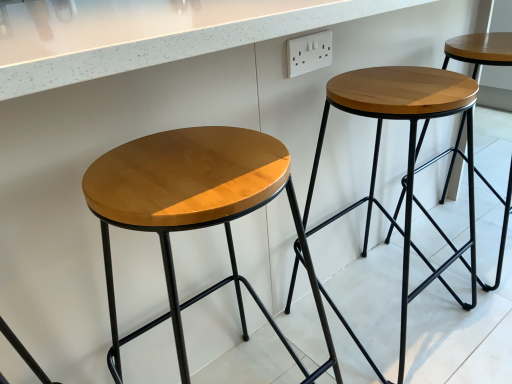
Measure the distance between wooden stool at center, placed as the first stool when sorted from right to left, and camera.

The distance of wooden stool at center, placed as the first stool when sorted from right to left, from camera is 31.53 inches.

The width and height of the screenshot is (512, 384). I want to click on white plastic outlet at upper center, so click(309, 53).

Find the location of a particular element. wooden stool at center, placed as the first stool when sorted from right to left is located at coordinates click(x=411, y=158).

Which of these two, white plastic outlet at upper center or matte wood stool at center, which is counted as the first stool, starting from the left, is bigger?

With larger size is matte wood stool at center, which is counted as the first stool, starting from the left.

Is white plastic outlet at upper center in front of or behind matte wood stool at center, which is the second stool in right-to-left order, in the image?

In the image, white plastic outlet at upper center appears behind matte wood stool at center, which is the second stool in right-to-left order.

Does white plastic outlet at upper center have a lesser width compared to matte wood stool at center, which is counted as the first stool, starting from the left?

Correct, the width of white plastic outlet at upper center is less than that of matte wood stool at center, which is counted as the first stool, starting from the left.

Between matte wood stool at center, which is the second stool in right-to-left order, and white plastic outlet at upper center, which one has smaller width?

Thinner between the two is white plastic outlet at upper center.

Considering the sizes of matte wood stool at center, which is the second stool in right-to-left order, and white plastic outlet at upper center in the image, is matte wood stool at center, which is the second stool in right-to-left order, bigger or smaller than white plastic outlet at upper center?

Clearly, matte wood stool at center, which is the second stool in right-to-left order, is larger in size than white plastic outlet at upper center.

Is matte wood stool at center, which is the second stool in right-to-left order, aimed at white plastic outlet at upper center?

No, matte wood stool at center, which is the second stool in right-to-left order, is not aimed at white plastic outlet at upper center.

Considering the relative sizes of white plastic outlet at upper center and wooden stool at center, the second stool when ordered from left to right, in the image provided, is white plastic outlet at upper center smaller than wooden stool at center, the second stool when ordered from left to right,?

Correct, white plastic outlet at upper center occupies less space than wooden stool at center, the second stool when ordered from left to right.

Which of these two, white plastic outlet at upper center or wooden stool at center, placed as the first stool when sorted from right to left, stands shorter?

Standing shorter between the two is white plastic outlet at upper center.

Does white plastic outlet at upper center turn towards wooden stool at center, the second stool when ordered from left to right?

No, white plastic outlet at upper center is not facing towards wooden stool at center, the second stool when ordered from left to right.

Is white plastic outlet at upper center directly adjacent to wooden stool at center, the second stool when ordered from left to right?

There is a gap between white plastic outlet at upper center and wooden stool at center, the second stool when ordered from left to right.

From the image's perspective, is matte wood stool at center, which is the second stool in right-to-left order, beneath wooden stool at center, placed as the first stool when sorted from right to left?

Indeed, from the image's perspective, matte wood stool at center, which is the second stool in right-to-left order, is shown beneath wooden stool at center, placed as the first stool when sorted from right to left.

Considering their positions, is matte wood stool at center, which is the second stool in right-to-left order, located in front of or behind wooden stool at center, placed as the first stool when sorted from right to left?

Visually, matte wood stool at center, which is the second stool in right-to-left order, is located in front of wooden stool at center, placed as the first stool when sorted from right to left.

Between matte wood stool at center, which is the second stool in right-to-left order, and wooden stool at center, the second stool when ordered from left to right, which one has larger width?

With larger width is wooden stool at center, the second stool when ordered from left to right.

Who is taller, matte wood stool at center, which is the second stool in right-to-left order, or wooden stool at center, placed as the first stool when sorted from right to left?

With more height is matte wood stool at center, which is the second stool in right-to-left order.

Could matte wood stool at center, which is the second stool in right-to-left order, be considered to be inside wooden stool at center, placed as the first stool when sorted from right to left?

Actually, matte wood stool at center, which is the second stool in right-to-left order, is outside wooden stool at center, placed as the first stool when sorted from right to left.

Considering the sizes of wooden stool at center, placed as the first stool when sorted from right to left, and matte wood stool at center, which is counted as the first stool, starting from the left, in the image, is wooden stool at center, placed as the first stool when sorted from right to left, wider or thinner than matte wood stool at center, which is counted as the first stool, starting from the left,?

In the image, wooden stool at center, placed as the first stool when sorted from right to left, appears to be wider than matte wood stool at center, which is counted as the first stool, starting from the left.

Consider the image. Is wooden stool at center, the second stool when ordered from left to right, taller than matte wood stool at center, which is the second stool in right-to-left order?

Incorrect, the height of wooden stool at center, the second stool when ordered from left to right, is not larger of that of matte wood stool at center, which is the second stool in right-to-left order.

Which of these two, wooden stool at center, the second stool when ordered from left to right, or white plastic outlet at upper center, is thinner?

Thinner between the two is white plastic outlet at upper center.

Is wooden stool at center, the second stool when ordered from left to right, positioned with its back to white plastic outlet at upper center?

No, wooden stool at center, the second stool when ordered from left to right, is not facing away from white plastic outlet at upper center.

Does point (439, 114) lie behind point (287, 51)?

No.

In order to click on stool that is the 2nd one when counting forward from the white plastic outlet at upper center in this screenshot , I will do `click(193, 209)`.

You are a GUI agent. You are given a task and a screenshot of the screen. Output one action in this format:
    pyautogui.click(x=<x>, y=<y>)
    Task: Click on the electric outlet on the right of matte wood stool at center, which is the second stool in right-to-left order
    Image resolution: width=512 pixels, height=384 pixels.
    Given the screenshot: What is the action you would take?
    pyautogui.click(x=309, y=53)

Which object lies nearer to the anchor point white plastic outlet at upper center, wooden stool at center, placed as the first stool when sorted from right to left, or matte wood stool at center, which is the second stool in right-to-left order?

wooden stool at center, placed as the first stool when sorted from right to left, is positioned closer to the anchor white plastic outlet at upper center.

Looking at the image, which one is located closer to white plastic outlet at upper center, matte wood stool at center, which is the second stool in right-to-left order, or wooden stool at center, placed as the first stool when sorted from right to left?

The object closer to white plastic outlet at upper center is wooden stool at center, placed as the first stool when sorted from right to left.

Estimate the real-world distances between objects in this image. Which object is further from wooden stool at center, the second stool when ordered from left to right, matte wood stool at center, which is counted as the first stool, starting from the left, or white plastic outlet at upper center?

white plastic outlet at upper center is further to wooden stool at center, the second stool when ordered from left to right.

Which object lies nearer to the anchor point wooden stool at center, placed as the first stool when sorted from right to left, white plastic outlet at upper center or matte wood stool at center, which is the second stool in right-to-left order?

matte wood stool at center, which is the second stool in right-to-left order, is positioned closer to the anchor wooden stool at center, placed as the first stool when sorted from right to left.

From the image, which object appears to be nearer to matte wood stool at center, which is counted as the first stool, starting from the left, wooden stool at center, placed as the first stool when sorted from right to left, or white plastic outlet at upper center?

wooden stool at center, placed as the first stool when sorted from right to left.

From the image, which object appears to be nearer to matte wood stool at center, which is the second stool in right-to-left order, white plastic outlet at upper center or wooden stool at center, the second stool when ordered from left to right?

The object closer to matte wood stool at center, which is the second stool in right-to-left order, is wooden stool at center, the second stool when ordered from left to right.

The height and width of the screenshot is (384, 512). In order to click on stool between white plastic outlet at upper center and matte wood stool at center, which is the second stool in right-to-left order, in the vertical direction in this screenshot , I will do `click(411, 158)`.